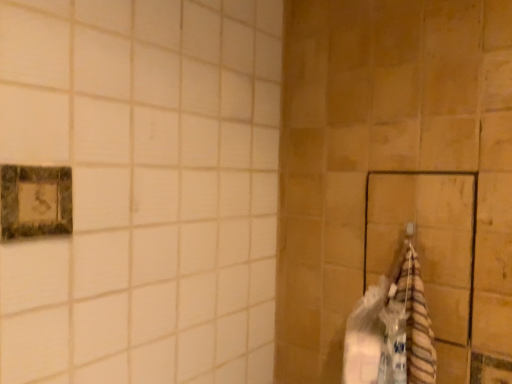
Find the location of `wooden frame at upper left`. wooden frame at upper left is located at coordinates (35, 201).

Measure the distance between point (64, 180) and camera.

The depth of point (64, 180) is 24.37 inches.

What do you see at coordinates (35, 201) in the screenshot? This screenshot has height=384, width=512. I see `wooden frame at upper left` at bounding box center [35, 201].

This screenshot has width=512, height=384. In order to click on wooden frame at upper left in this screenshot , I will do `click(35, 201)`.